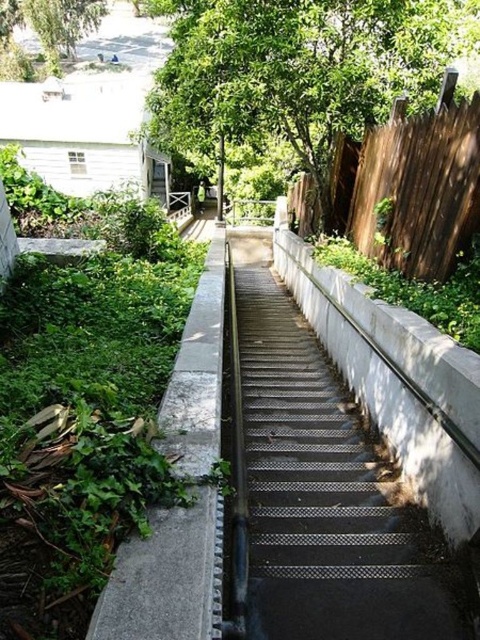
Question: From the image, what is the correct spatial relationship of green leafy tree at upper center in relation to brown wooden fence at upper right?

Choices:
 (A) right
 (B) left

Answer: (B)

Question: Which object is farther from the camera taking this photo?

Choices:
 (A) green leafy tree at upper left
 (B) brown wooden fence at upper right
 (C) metallic mesh stairs at center
 (D) green leafy tree at upper center

Answer: (A)

Question: Does metallic mesh stairs at center have a greater width compared to green leafy tree at upper center?

Choices:
 (A) no
 (B) yes

Answer: (A)

Question: Which point is farther from the camera taking this photo?

Choices:
 (A) (384, 170)
 (B) (263, 448)
 (C) (14, 80)

Answer: (C)

Question: Considering the relative positions of green leafy tree at upper center and gray concrete wall at left in the image provided, where is green leafy tree at upper center located with respect to gray concrete wall at left?

Choices:
 (A) left
 (B) right

Answer: (A)

Question: Among these points, which one is nearest to the camera?

Choices:
 (A) (17, 74)
 (B) (363, 202)
 (C) (261, 10)

Answer: (C)